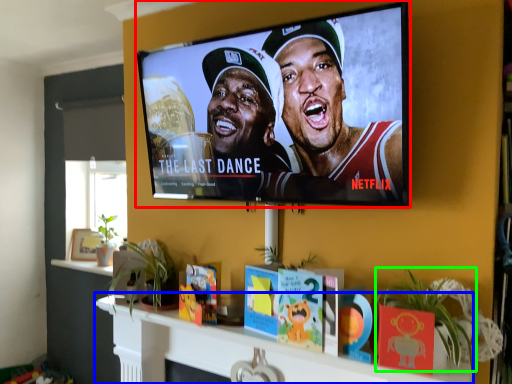
Question: Considering the real-world distances, which object is closest to television (highlighted by a red box)? shelf (highlighted by a blue box) or plant (highlighted by a green box).

Choices:
 (A) shelf
 (B) plant

Answer: (B)